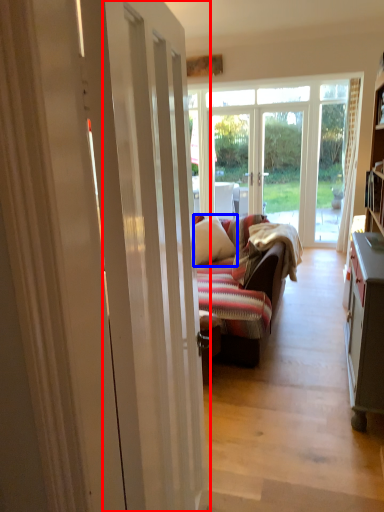
Question: Among these objects, which one is farthest to the camera, door (highlighted by a red box) or pillow (highlighted by a blue box)?

Choices:
 (A) door
 (B) pillow

Answer: (B)